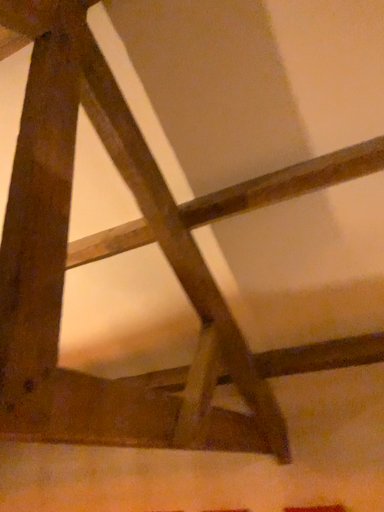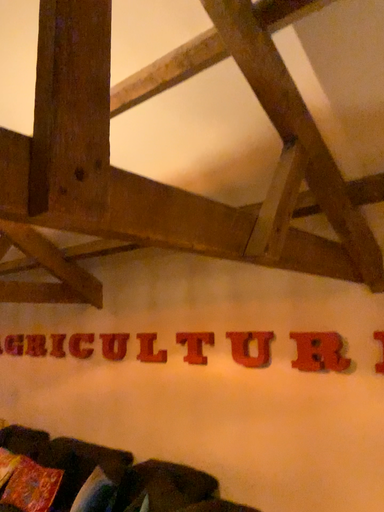
Question: How did the camera likely rotate when shooting the video?

Choices:
 (A) rotated upward
 (B) rotated downward

Answer: (B)